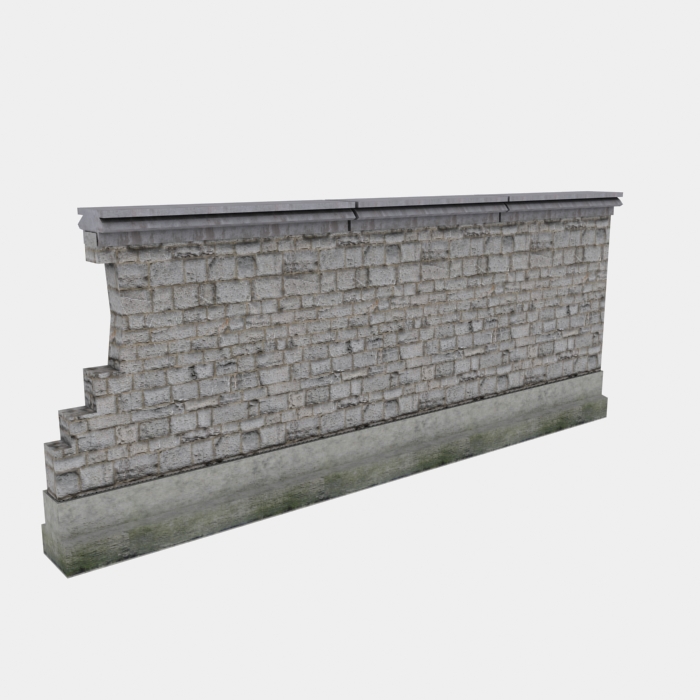
The height and width of the screenshot is (700, 700). I want to click on shelf like object, so click(x=549, y=203).